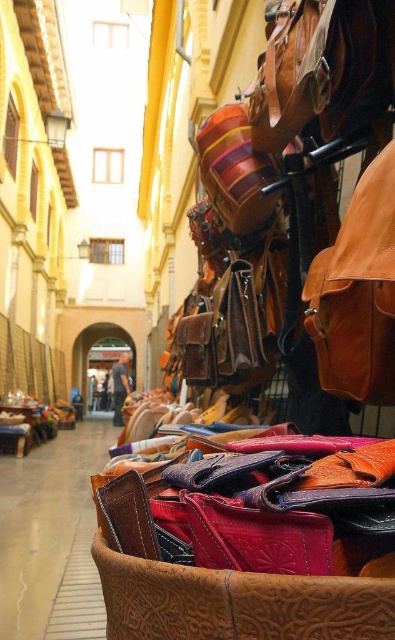
You are a customer in the market and want to buy a wallet. You see the brown leather wallet at center and the matte brown leather store at center. Which item is located lower in the display?

The brown leather wallet at center is located lower than the matte brown leather store at center in the display.

You are a customer looking to purchase a wallet that can fit in your pocket. You see the brown leather wallet at center and the matte brown leather store at center. Which one is more likely to fit in your pocket based on their sizes?

The matte brown leather store at center is smaller in size than the brown leather wallet at center, so it is more likely to fit in your pocket.